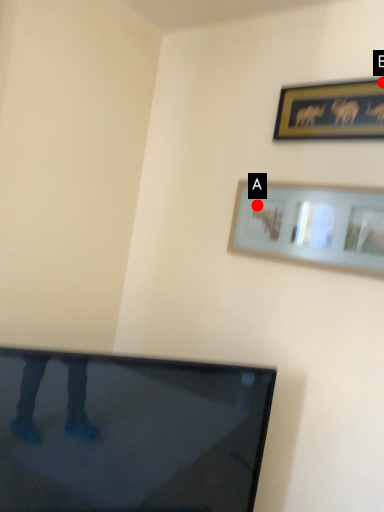
Question: Two points are circled on the image, labeled by A and B beside each circle. Which point is closer to the camera?

Choices:
 (A) A is closer
 (B) B is closer

Answer: (B)